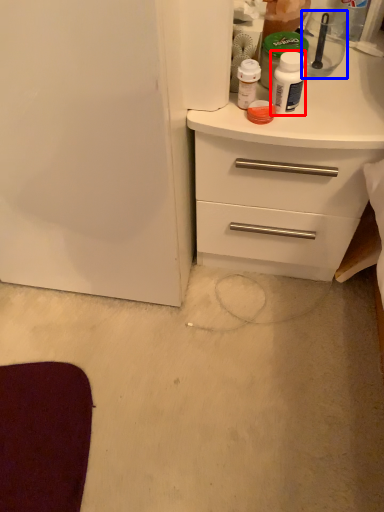
Question: Which point is further to the camera, bottle (highlighted by a red box) or appliance (highlighted by a blue box)?

Choices:
 (A) bottle
 (B) appliance

Answer: (B)